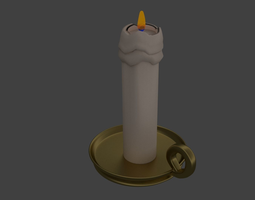
I want to click on candle, so click(x=137, y=96).